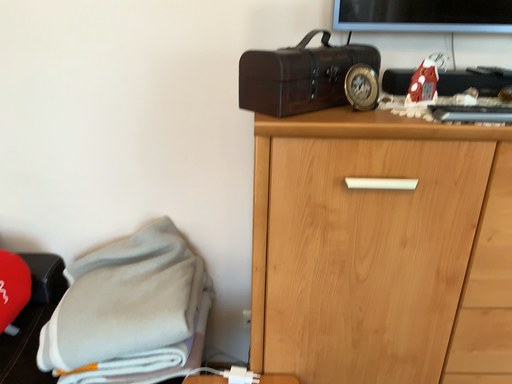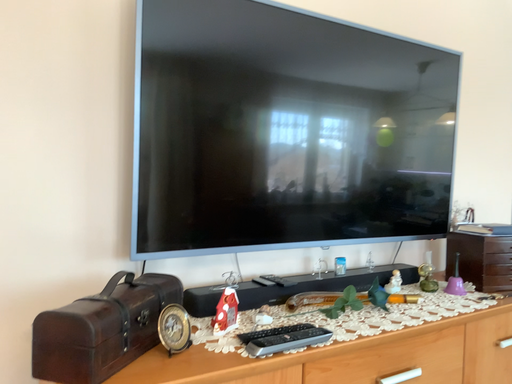
Question: Which way did the camera rotate in the video?

Choices:
 (A) rotated right
 (B) rotated left

Answer: (A)